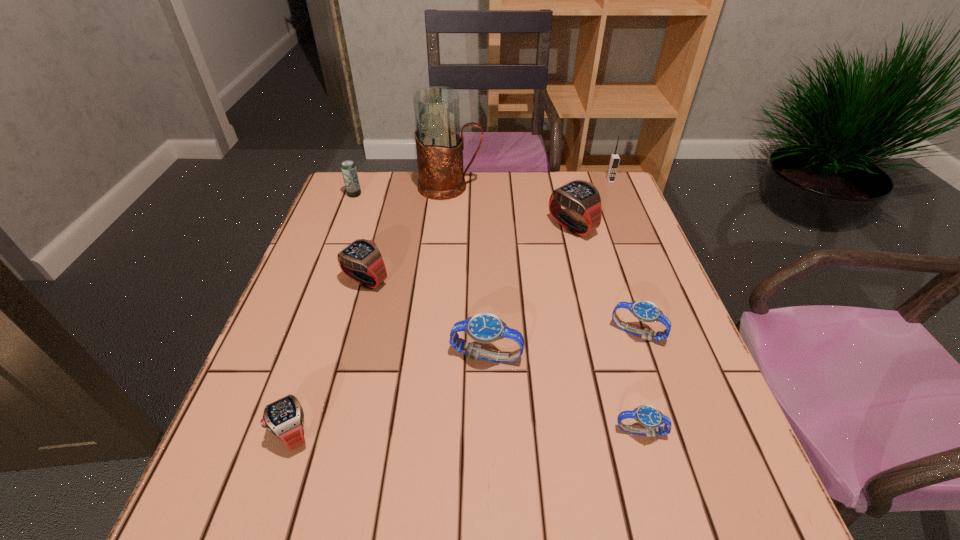
Where is `vacant space that is in between the rightmost object and the second smallest blue watch`? The image size is (960, 540). vacant space that is in between the rightmost object and the second smallest blue watch is located at coordinates (624, 257).

Find the location of `free spot between the fourth watch from right to left and the cellular telephone`. free spot between the fourth watch from right to left and the cellular telephone is located at coordinates (548, 268).

Where is `free area in between the third watch from left to right and the cellular telephone`? free area in between the third watch from left to right and the cellular telephone is located at coordinates (548, 268).

At what (x,y) coordinates should I click in order to perform the action: click on empty space between the smallest blue watch and the beer can. Please return your answer as a coordinate pair (x, y). The height and width of the screenshot is (540, 960). Looking at the image, I should click on (497, 313).

In order to click on vacant space that is in between the biggest blue watch and the beer can in this screenshot , I will do `click(420, 275)`.

Identify the location of free space between the nearest red watch and the second biggest blue watch. The width and height of the screenshot is (960, 540). (466, 383).

Identify the location of unoccupied position between the biggest blue watch and the second biggest red watch. (426, 318).

Where is `free space between the pitcher and the nearest blue watch`? free space between the pitcher and the nearest blue watch is located at coordinates (545, 309).

Image resolution: width=960 pixels, height=540 pixels. I want to click on object that is the closest to the tallest object, so 348,168.

The height and width of the screenshot is (540, 960). In order to click on the seventh closest object to the beer can in this screenshot , I will do `click(645, 311)`.